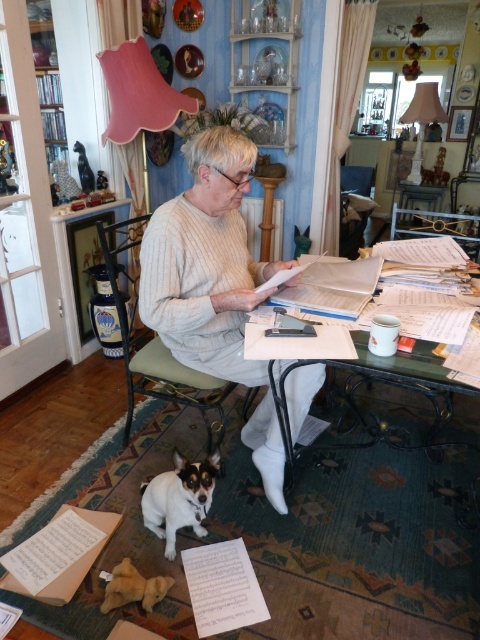
Question: Which object appears closest to the camera in this image?

Choices:
 (A) brown and white fur dog at lower left
 (B) translucent glass table at center

Answer: (B)

Question: Is green fabric chair at center to the left of white paper book at center from the viewer's perspective?

Choices:
 (A) no
 (B) yes

Answer: (B)

Question: From the image, what is the correct spatial relationship of translucent glass table at center in relation to white paper book at center?

Choices:
 (A) above
 (B) below

Answer: (B)

Question: Is green fabric chair at center bigger than white paper book at center?

Choices:
 (A) no
 (B) yes

Answer: (B)

Question: Which of these objects is positioned closest to the white paper book at center?

Choices:
 (A) brown and white fur dog at lower left
 (B) translucent glass table at center
 (C) green fabric chair at center

Answer: (B)

Question: Estimate the real-world distances between objects in this image. Which object is closer to the green fabric chair at center?

Choices:
 (A) translucent glass table at center
 (B) white paper book at center

Answer: (A)